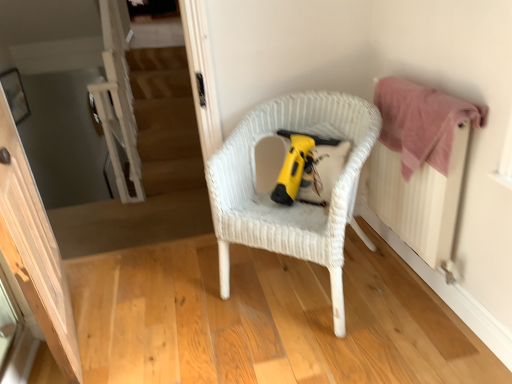
At what (x,y) coordinates should I click in order to perform the action: click on free region under pink fabric radiator at right (from a real-world perspective). Please return your answer as a coordinate pair (x, y). Looking at the image, I should click on (400, 270).